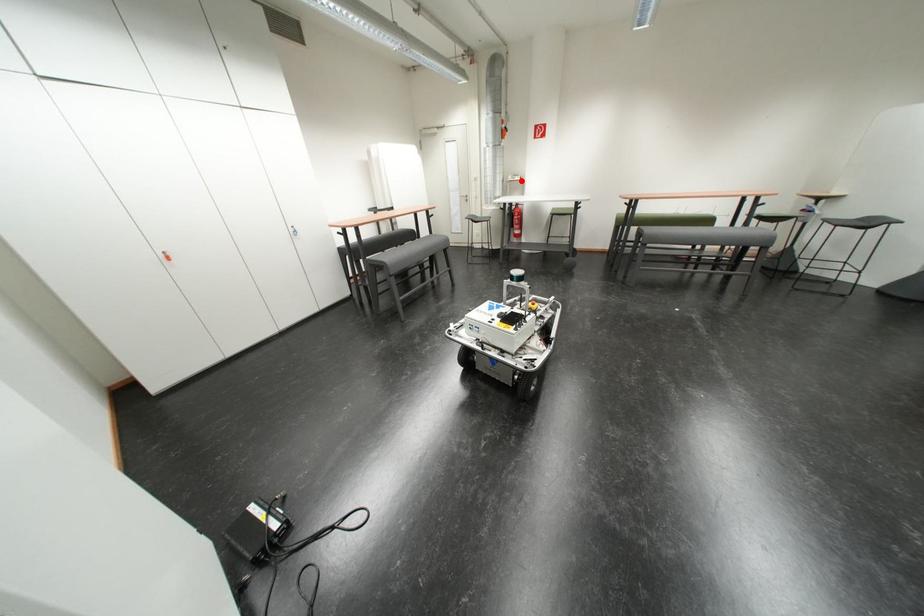
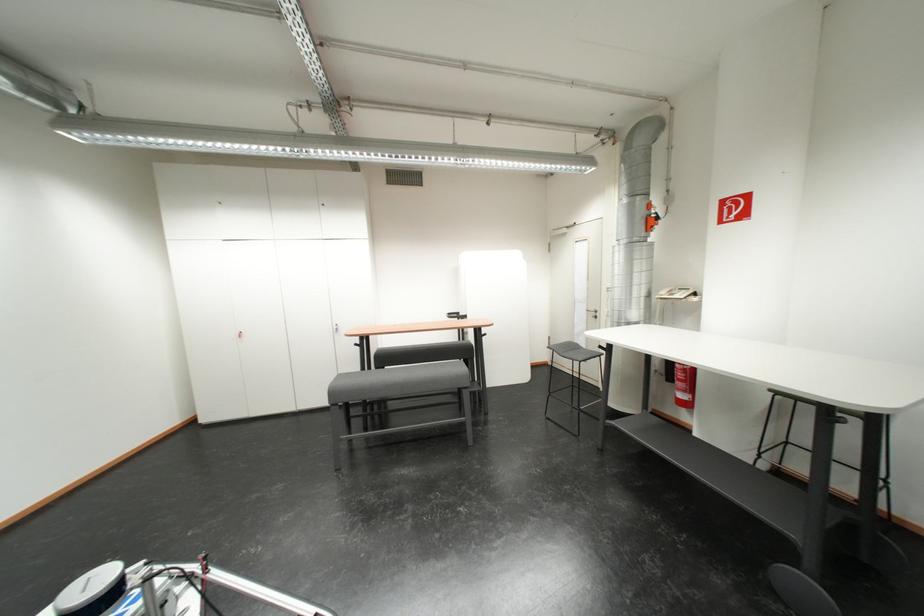
Where in the second image is the point corresponding to the highlighted location from the first image?

(675, 296)